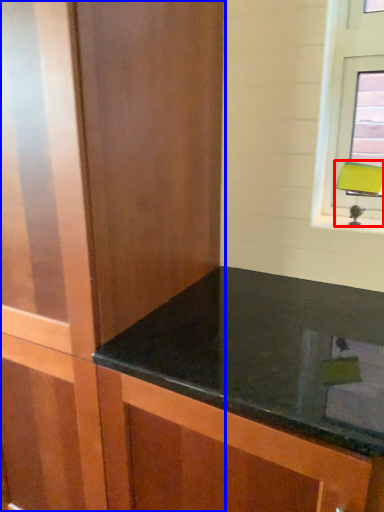
Question: Which of the following is the closest to the observer, table lamp (highlighted by a red box) or dresser (highlighted by a blue box)?

Choices:
 (A) table lamp
 (B) dresser

Answer: (B)